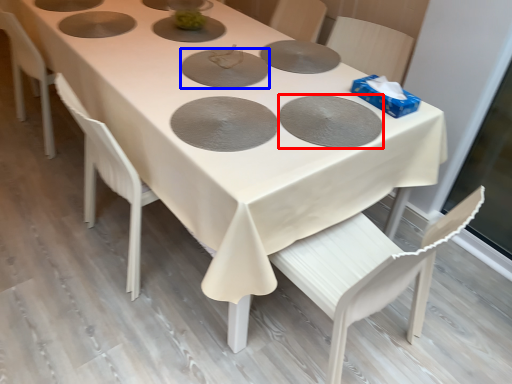
Question: Which object appears farthest to the camera in this image, pizza pan (highlighted by a red box) or pizza pan (highlighted by a blue box)?

Choices:
 (A) pizza pan
 (B) pizza pan

Answer: (B)